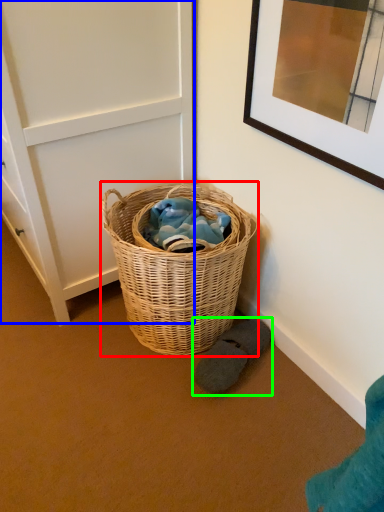
Question: Which is farther away from picnic basket (highlighted by a red box)? door (highlighted by a blue box) or footwear (highlighted by a green box)?

Choices:
 (A) door
 (B) footwear

Answer: (A)